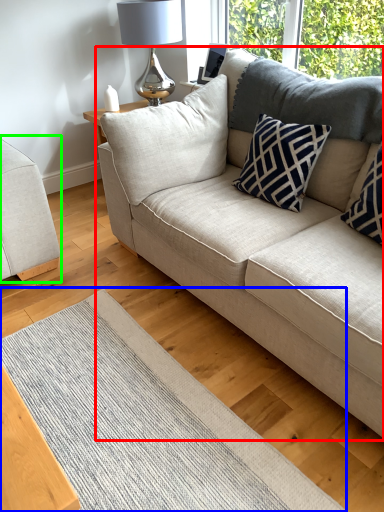
Question: Which is nearer to the studio couch (highlighted by a red box)? mat (highlighted by a blue box) or studio couch (highlighted by a green box).

Choices:
 (A) mat
 (B) studio couch

Answer: (A)